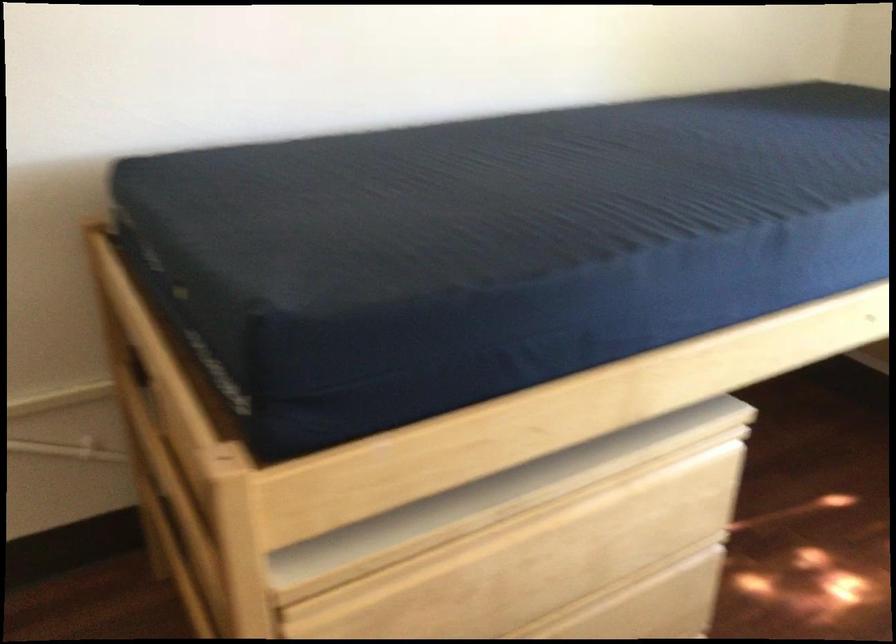
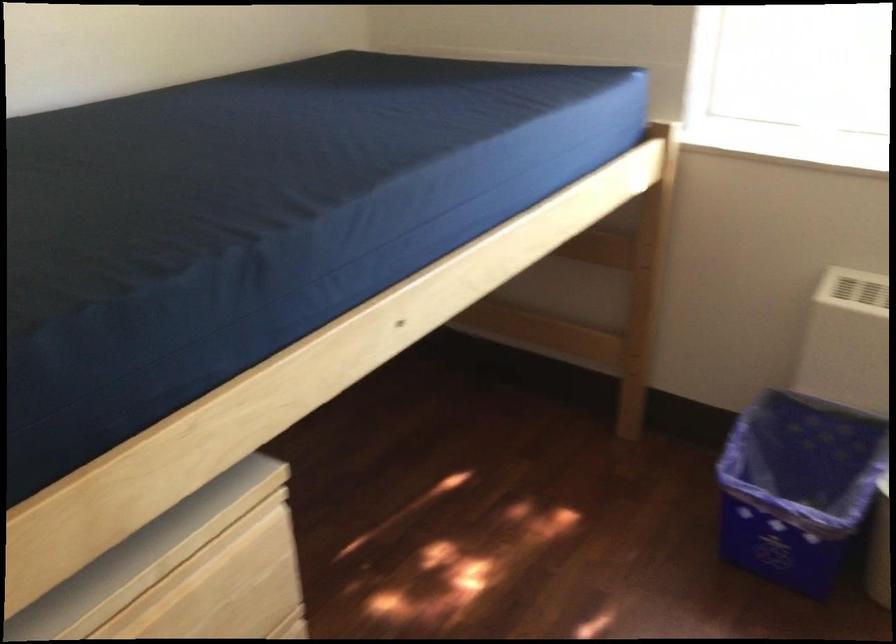
Question: The first image is from the beginning of the video and the second image is from the end. How did the camera likely rotate when shooting the video?

Choices:
 (A) Left
 (B) Right
 (C) Up
 (D) Down

Answer: (B)